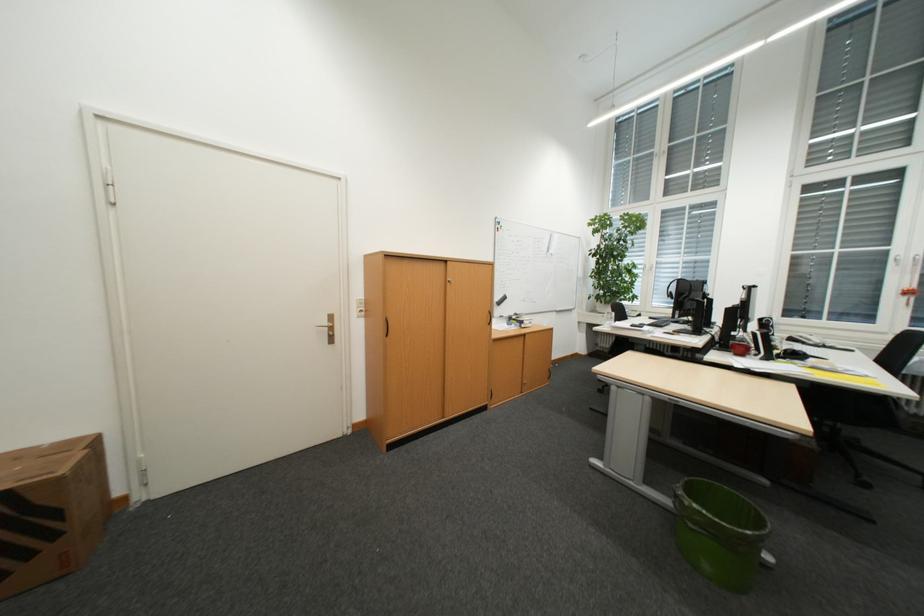
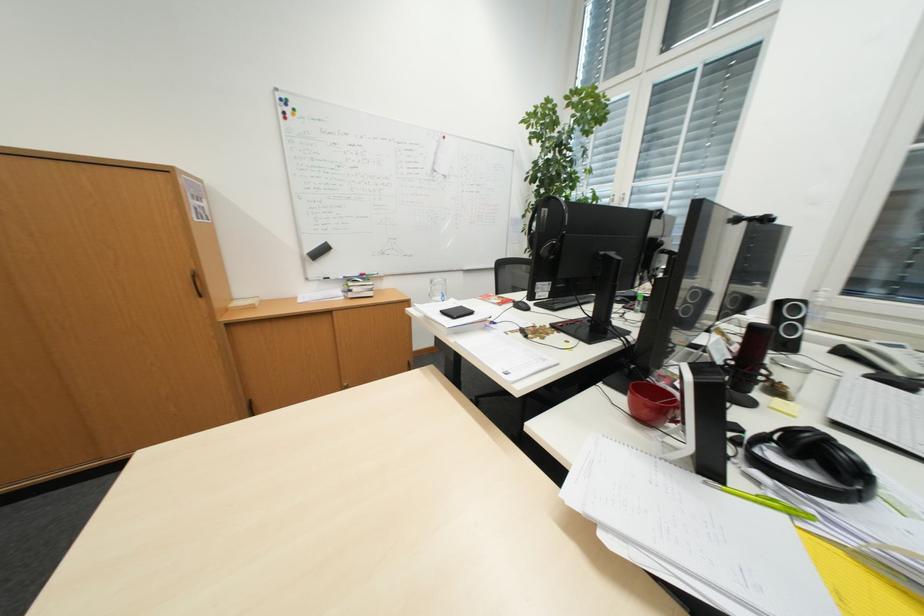
What movement of the cameraman would produce the second image?

The cameraman moved toward right, forward.